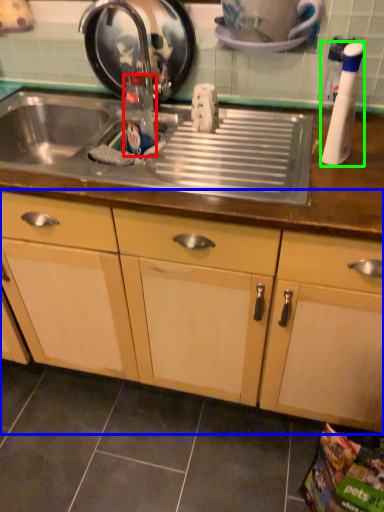
Question: Considering the real-world distances, which object is closest to bottle (highlighted by a red box)? cabinetry (highlighted by a blue box) or bottle (highlighted by a green box).

Choices:
 (A) cabinetry
 (B) bottle

Answer: (B)